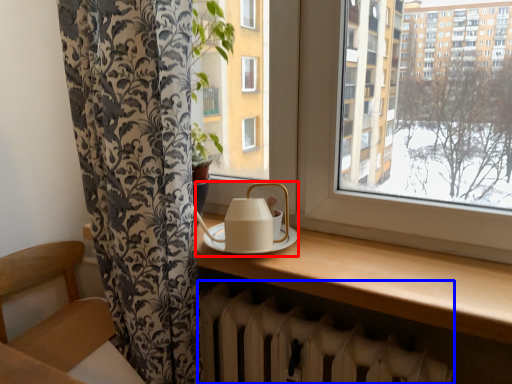
Question: Which object is closer to the camera taking this photo, tea set (highlighted by a red box) or radiator (highlighted by a blue box)?

Choices:
 (A) tea set
 (B) radiator

Answer: (B)